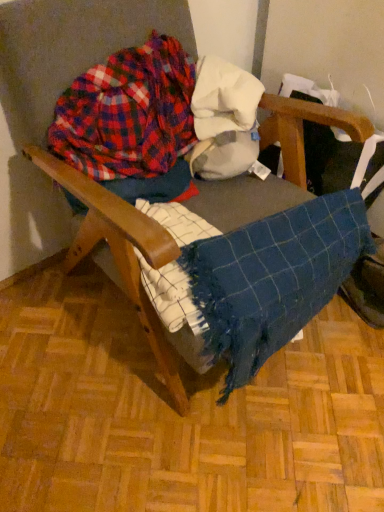
In order to face blue woven blanket at center, should I rotate leftwards or rightwards?

Turn right approximately 12.661 degrees to face it.

What do you see at coordinates (273, 278) in the screenshot? I see `blue woven blanket at center` at bounding box center [273, 278].

Find the location of a particular element. blue woven blanket at center is located at coordinates (273, 278).

The height and width of the screenshot is (512, 384). Find the location of `plaid fabric at upper left`. plaid fabric at upper left is located at coordinates (128, 113).

Describe the element at coordinates (128, 113) in the screenshot. This screenshot has width=384, height=512. I see `plaid fabric at upper left` at that location.

The image size is (384, 512). I want to click on blue woven blanket at center, so click(273, 278).

Based on their positions, is plaid fabric at upper left located to the left or right of blue woven blanket at center?

Clearly, plaid fabric at upper left is on the left of blue woven blanket at center in the image.

Which object is further away from the camera taking this photo, plaid fabric at upper left or blue woven blanket at center?

plaid fabric at upper left is more distant.

Considering the points (145, 75) and (253, 289), which point is behind, point (145, 75) or point (253, 289)?

Positioned behind is point (145, 75).

From the image's perspective, which object appears higher, plaid fabric at upper left or blue woven blanket at center?

plaid fabric at upper left appears higher in the image.

From a real-world perspective, is plaid fabric at upper left under blue woven blanket at center?

Incorrect, from a real-world perspective, plaid fabric at upper left is higher than blue woven blanket at center.

Can you confirm if plaid fabric at upper left is thinner than blue woven blanket at center?

Yes.

Is plaid fabric at upper left shorter than blue woven blanket at center?

Yes, plaid fabric at upper left is shorter than blue woven blanket at center.

Is plaid fabric at upper left bigger or smaller than blue woven blanket at center?

plaid fabric at upper left is smaller than blue woven blanket at center.

Can blue woven blanket at center be found inside plaid fabric at upper left?

No, blue woven blanket at center is not a part of plaid fabric at upper left.

Is plaid fabric at upper left directly adjacent to blue woven blanket at center?

No, plaid fabric at upper left is not in contact with blue woven blanket at center.

Is plaid fabric at upper left facing away from blue woven blanket at center?

That's not correct — plaid fabric at upper left is not looking away from blue woven blanket at center.

Based on the photo, measure the distance between plaid fabric at upper left and blue woven blanket at center.

plaid fabric at upper left is 40.74 centimeters from blue woven blanket at center.

This screenshot has height=512, width=384. What are the coordinates of `blanket that is below the plaid fabric at upper left (from the image's perspective)` in the screenshot? It's located at (273, 278).

Can you confirm if blue woven blanket at center is positioned to the right of plaid fabric at upper left?

Correct, you'll find blue woven blanket at center to the right of plaid fabric at upper left.

Is the position of blue woven blanket at center more distant than that of plaid fabric at upper left?

No, it is not.

Which is less distant, (232, 370) or (150, 64)?

Point (232, 370)

Consider the image. From the image's perspective, which is above, blue woven blanket at center or plaid fabric at upper left?

plaid fabric at upper left, from the image's perspective.

Looking at this image, from a real-world perspective, which object stands above the other?

plaid fabric at upper left is physically above.

Does blue woven blanket at center have a greater width compared to plaid fabric at upper left?

Yes, blue woven blanket at center is wider than plaid fabric at upper left.

Considering the sizes of objects blue woven blanket at center and plaid fabric at upper left in the image provided, who is taller, blue woven blanket at center or plaid fabric at upper left?

blue woven blanket at center is taller.

Considering the sizes of objects blue woven blanket at center and plaid fabric at upper left in the image provided, who is smaller, blue woven blanket at center or plaid fabric at upper left?

plaid fabric at upper left is smaller.

Could plaid fabric at upper left be considered to be inside blue woven blanket at center?

No.

Is blue woven blanket at center touching plaid fabric at upper left?

No, blue woven blanket at center is not making contact with plaid fabric at upper left.

Is blue woven blanket at center aimed at plaid fabric at upper left?

No, blue woven blanket at center does not turn towards plaid fabric at upper left.

Can you tell me how much blue woven blanket at center and plaid fabric at upper left differ in facing direction?

The angular difference between blue woven blanket at center and plaid fabric at upper left is 12.3 degrees.

How distant is blue woven blanket at center from plaid fabric at upper left?

blue woven blanket at center is 16.04 inches away from plaid fabric at upper left.

At what (x,y) coordinates should I click in order to perform the action: click on blanket below the plaid fabric at upper left (from the image's perspective). Please return your answer as a coordinate pair (x, y). Looking at the image, I should click on (273, 278).

Where is `flannel that appears above the blue woven blanket at center (from the image's perspective)`? flannel that appears above the blue woven blanket at center (from the image's perspective) is located at coordinates (128, 113).

Where is `flannel positioned vertically above the blue woven blanket at center (from a real-world perspective)`? flannel positioned vertically above the blue woven blanket at center (from a real-world perspective) is located at coordinates (128, 113).